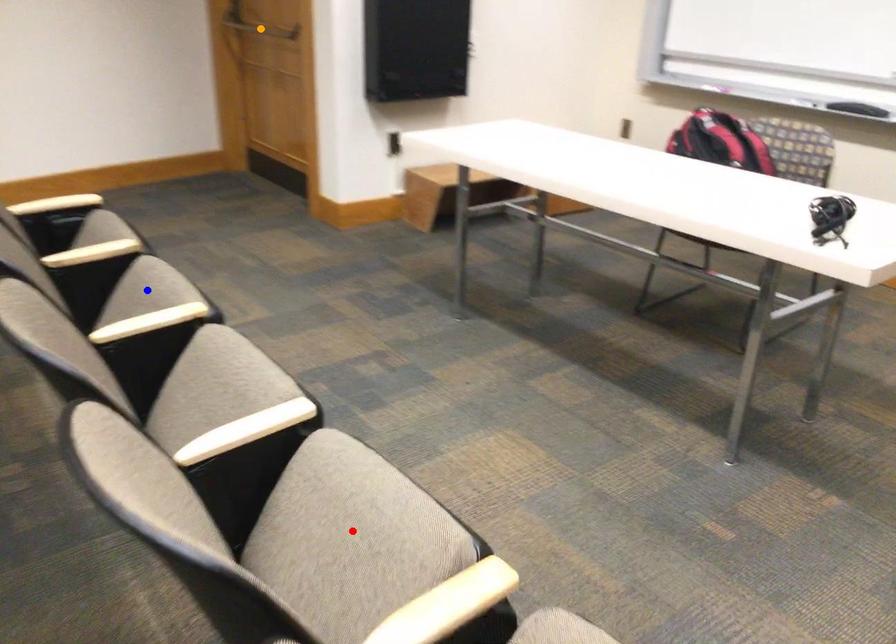
Consider the image. Order these from farthest to nearest:
blue point, orange point, red point

orange point → blue point → red point